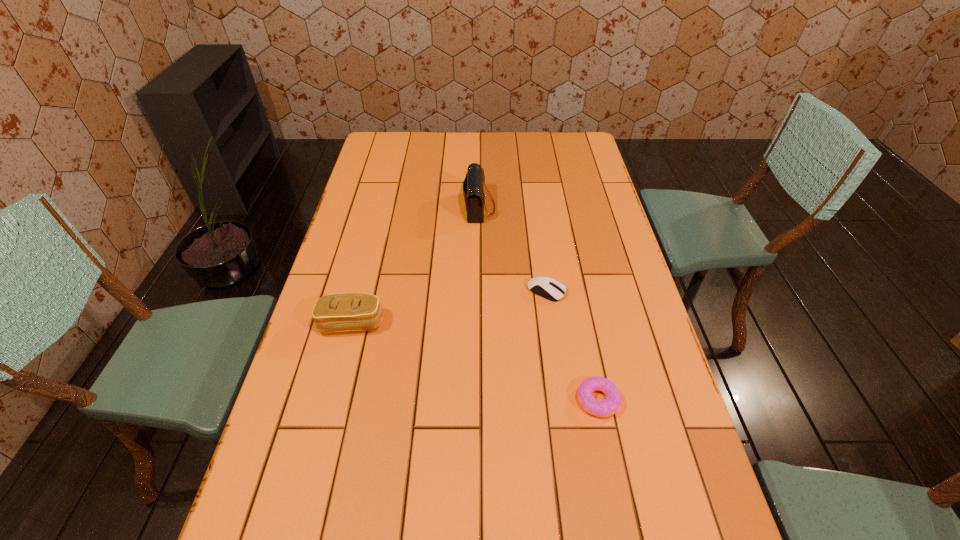
Image resolution: width=960 pixels, height=540 pixels. I want to click on blank space that satisfies the following two spatial constraints: 1. on the front flap of the taller clutch bag; 2. on the zipper side of the shorter clutch bag, so click(479, 323).

Find the location of a particular element. vacant space that satisfies the following two spatial constraints: 1. on the front flap of the doughnut; 2. on the right side of the tallest object is located at coordinates (479, 400).